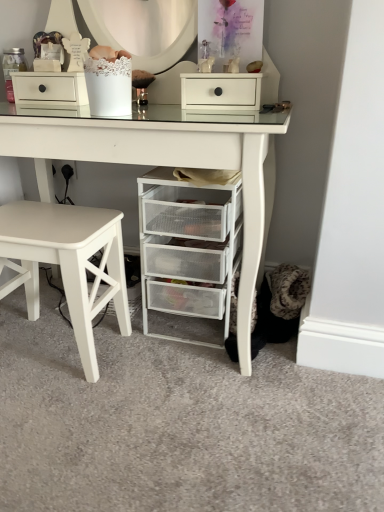
Locate an element on the screen. The height and width of the screenshot is (512, 384). free spot above white matte stool at lower left (from a real-world perspective) is located at coordinates (40, 222).